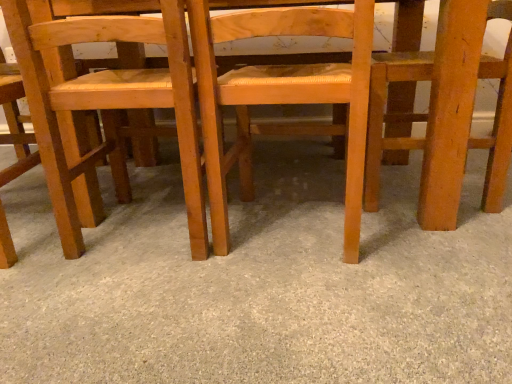
Question: Is wooden chair at right, which appears as the 1th chair when viewed from the right, aimed at light brown wood chair at left, positioned as the first chair in left-to-right order?

Choices:
 (A) no
 (B) yes

Answer: (B)

Question: Is wooden chair at right, which appears as the 1th chair when viewed from the right, at the left side of light brown wood chair at left, the 4th chair viewed from the right?

Choices:
 (A) yes
 (B) no

Answer: (B)

Question: Is wooden chair at right, which appears as the 1th chair when viewed from the right, to the right of light brown wood chair at left, positioned as the first chair in left-to-right order, from the viewer's perspective?

Choices:
 (A) no
 (B) yes

Answer: (B)

Question: Does wooden chair at right, which appears as the 1th chair when viewed from the right, have a larger size compared to light brown wood chair at left, positioned as the first chair in left-to-right order?

Choices:
 (A) no
 (B) yes

Answer: (B)

Question: Considering the relative sizes of wooden chair at right, which appears as the 1th chair when viewed from the right, and light brown wood chair at left, the 4th chair viewed from the right, in the image provided, is wooden chair at right, which appears as the 1th chair when viewed from the right, wider than light brown wood chair at left, the 4th chair viewed from the right,?

Choices:
 (A) yes
 (B) no

Answer: (A)

Question: Looking at the image, does wooden chair at right, the fourth chair from the left, seem bigger or smaller compared to smooth beige carpet at center?

Choices:
 (A) small
 (B) big

Answer: (A)

Question: From their relative heights in the image, would you say wooden chair at right, which appears as the 1th chair when viewed from the right, is taller or shorter than smooth beige carpet at center?

Choices:
 (A) tall
 (B) short

Answer: (A)

Question: Is point (442, 31) positioned closer to the camera than point (429, 322)?

Choices:
 (A) closer
 (B) farther

Answer: (B)

Question: In terms of width, does wooden chair at right, the fourth chair from the left, look wider or thinner when compared to smooth beige carpet at center?

Choices:
 (A) wide
 (B) thin

Answer: (B)

Question: From the image's perspective, is light brown wood chair at center, which appears as the 2th chair when viewed from the right, positioned above or below smooth beige carpet at center?

Choices:
 (A) above
 (B) below

Answer: (A)

Question: Relative to smooth beige carpet at center, is light brown wood chair at center, which appears as the 2th chair when viewed from the right, in front or behind?

Choices:
 (A) behind
 (B) front

Answer: (A)

Question: In terms of width, does light brown wood chair at center, which is counted as the third chair, starting from the left, look wider or thinner when compared to smooth beige carpet at center?

Choices:
 (A) wide
 (B) thin

Answer: (B)

Question: Considering the positions of light brown wood chair at center, which appears as the 2th chair when viewed from the right, and smooth beige carpet at center in the image, is light brown wood chair at center, which appears as the 2th chair when viewed from the right, taller or shorter than smooth beige carpet at center?

Choices:
 (A) short
 (B) tall

Answer: (B)

Question: Would you say smooth beige carpet at center is to the left or to the right of natural wood chair at center, the 3th chair viewed from the right, in the picture?

Choices:
 (A) right
 (B) left

Answer: (A)

Question: Looking at their shapes, would you say smooth beige carpet at center is wider or thinner than natural wood chair at center, marked as the 2th chair in a left-to-right arrangement?

Choices:
 (A) thin
 (B) wide

Answer: (B)